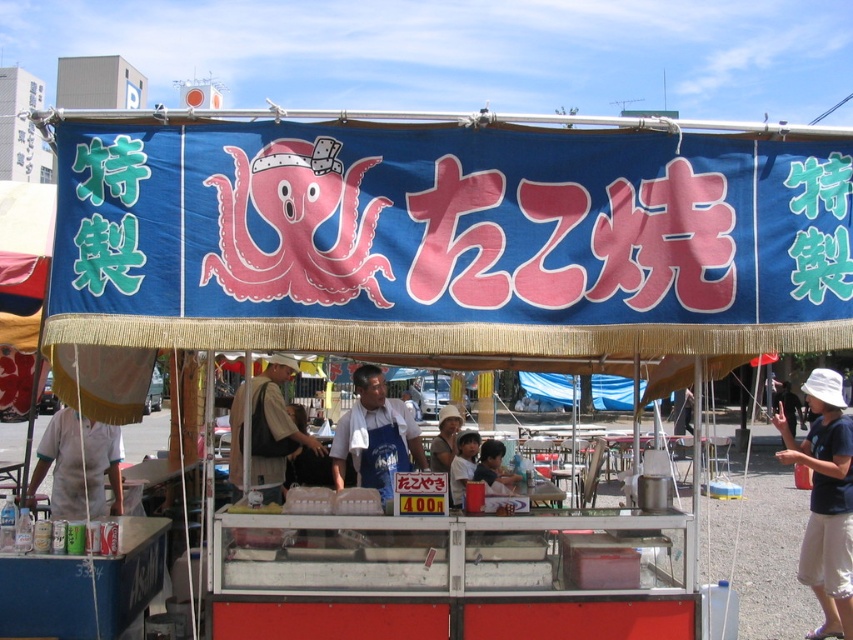
Question: Considering the real-world distances, which object is closest to the blue fabric canopy at upper center?

Choices:
 (A) blue apron at center
 (B) khaki fabric apron at center
 (C) white cotton hat at right

Answer: (A)

Question: Which point is farther to the camera?

Choices:
 (A) white cotton hat at right
 (B) blue fabric canopy at upper center
 (C) blue apron at center
 (D) khaki fabric apron at center

Answer: (C)

Question: Is blue fabric canopy at upper center to the left of white cotton hat at right from the viewer's perspective?

Choices:
 (A) yes
 (B) no

Answer: (A)

Question: Does blue fabric canopy at upper center have a lesser width compared to blue fabric canopy at center?

Choices:
 (A) no
 (B) yes

Answer: (A)

Question: Can you confirm if white cotton hat at right is positioned to the right of khaki fabric apron at center?

Choices:
 (A) no
 (B) yes

Answer: (B)

Question: Estimate the real-world distances between objects in this image. Which object is farther from the blue fabric canopy at center?

Choices:
 (A) white cotton hat at right
 (B) blue apron at center
 (C) blue fabric canopy at upper center
 (D) khaki fabric apron at center

Answer: (B)